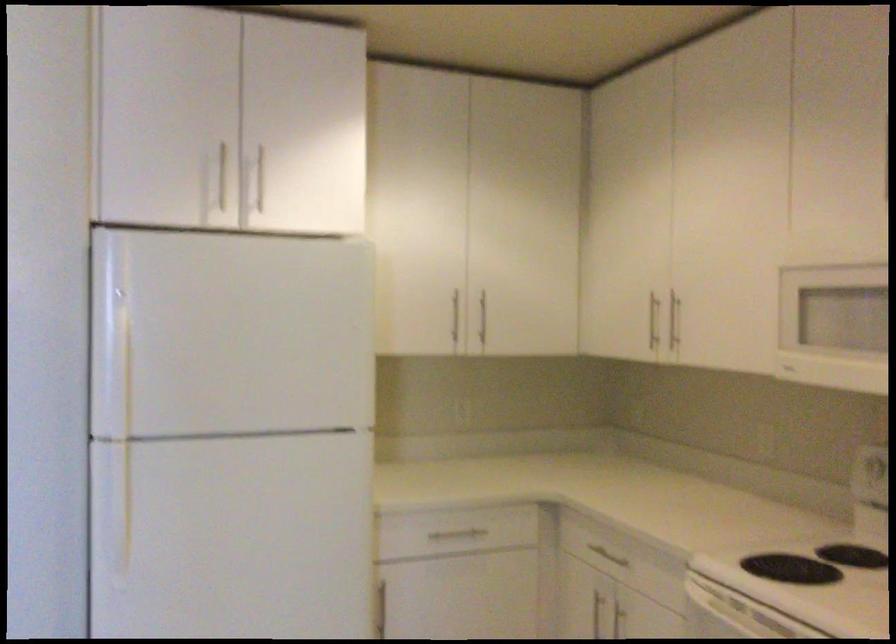
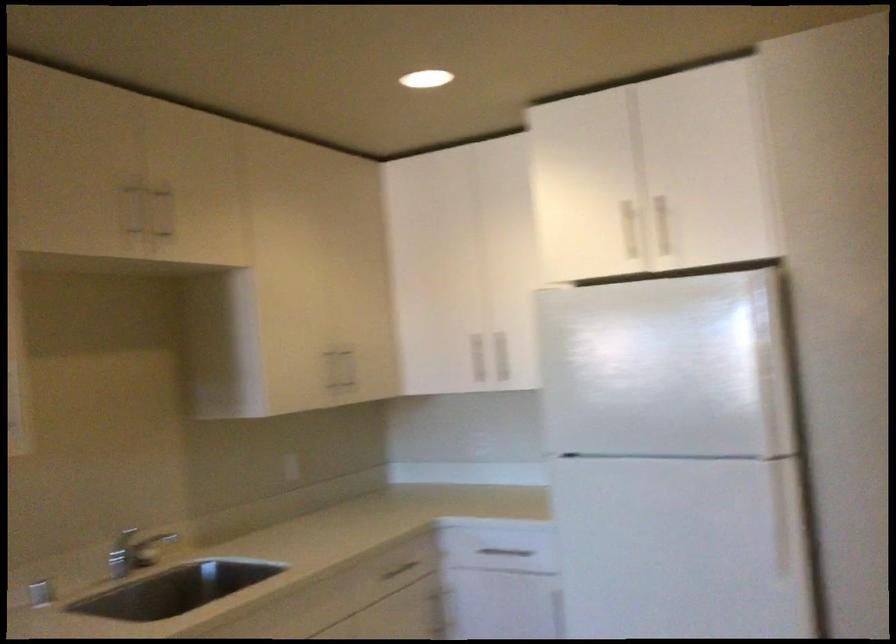
Question: The camera is either moving clockwise (left) or counter-clockwise (right) around the object. The first image is from the beginning of the video and the second image is from the end. Is the camera moving left or right when shooting the video?

Choices:
 (A) Left
 (B) Right

Answer: (B)